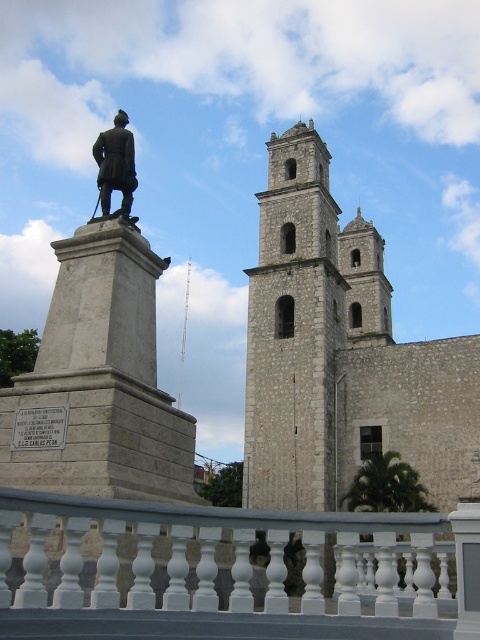
Question: Which object is closer to the camera taking this photo?

Choices:
 (A) white stone church at center
 (B) white stone tower at center
 (C) white painted wood railing at lower center
 (D) polished bronze statue at center

Answer: (C)

Question: Among these objects, which one is nearest to the camera?

Choices:
 (A) white stone church at center
 (B) polished bronze statue at center
 (C) white painted wood railing at lower center
 (D) white stone tower at center

Answer: (C)

Question: Can you confirm if white stone tower at center is thinner than polished bronze statue at center?

Choices:
 (A) yes
 (B) no

Answer: (B)

Question: Can you confirm if white stone church at center is smaller than polished bronze statue at center?

Choices:
 (A) no
 (B) yes

Answer: (A)

Question: Estimate the real-world distances between objects in this image. Which object is closer to the white stone tower at center?

Choices:
 (A) white stone church at center
 (B) polished bronze statue at center

Answer: (A)

Question: Does white stone church at center have a lesser width compared to polished bronze statue at center?

Choices:
 (A) no
 (B) yes

Answer: (A)